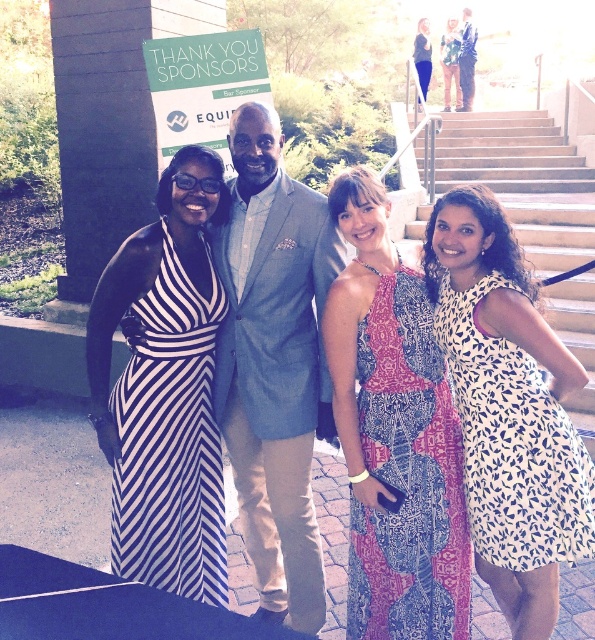
Can you confirm if patterned fabric dress at center is positioned above striped fabric dress at center?

No.

Is patterned fabric dress at center thinner than striped fabric dress at center?

No, patterned fabric dress at center is not thinner than striped fabric dress at center.

Measure the distance between point (399,625) and camera.

They are 7.86 feet apart.

The height and width of the screenshot is (640, 595). What are the coordinates of `patterned fabric dress at center` in the screenshot? It's located at (408, 477).

Does white printed dress at right have a larger size compared to matte black dress at upper center?

No, white printed dress at right is not bigger than matte black dress at upper center.

Does point (541, 522) come closer to viewer compared to point (452, 76)?

Yes, point (541, 522) is closer to viewer.

This screenshot has width=595, height=640. What do you see at coordinates (512, 442) in the screenshot?
I see `white printed dress at right` at bounding box center [512, 442].

You are a GUI agent. You are given a task and a screenshot of the screen. Output one action in this format:
    pyautogui.click(x=<x>, y=<y>)
    Task: Click on the white printed dress at right
    
    Given the screenshot: What is the action you would take?
    pyautogui.click(x=512, y=442)

Is light blue textured suit at center to the right of light beige stone stairs at upper right from the viewer's perspective?

No, light blue textured suit at center is not to the right of light beige stone stairs at upper right.

Between light blue textured suit at center and light beige stone stairs at upper right, which one has less height?

light blue textured suit at center

Is point (277, 284) positioned behind point (550, 248)?

No, it is not.

Where is `light blue textured suit at center`? light blue textured suit at center is located at coordinates (274, 364).